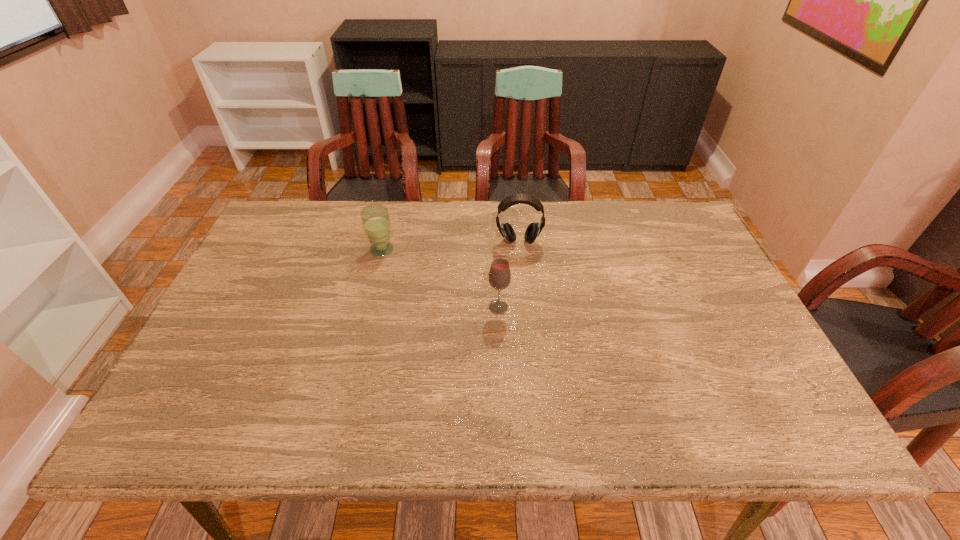
This screenshot has height=540, width=960. Identify the location of empty location between the leftmost object and the earphone. (450, 246).

Find the location of a particular element. The image size is (960, 540). unoccupied area between the leftmost object and the earphone is located at coordinates (450, 246).

In order to click on vacant space in between the left glass and the nearer glass in this screenshot , I will do `click(440, 279)`.

Locate an element on the screen. object that stands as the closest to the earphone is located at coordinates (499, 275).

Locate an element on the screen. This screenshot has height=540, width=960. the closest object to the earphone is located at coordinates (499, 275).

The height and width of the screenshot is (540, 960). I want to click on vacant space that satisfies the following two spatial constraints: 1. on the front side of the nearer glass; 2. on the left side of the left glass, so click(x=368, y=307).

The width and height of the screenshot is (960, 540). Identify the location of vacant space that satisfies the following two spatial constraints: 1. on the front side of the right glass; 2. on the left side of the farther glass. (368, 307).

The image size is (960, 540). Find the location of `free point that satisfies the following two spatial constraints: 1. on the front side of the nearer glass; 2. on the right side of the farther glass`. free point that satisfies the following two spatial constraints: 1. on the front side of the nearer glass; 2. on the right side of the farther glass is located at coordinates (368, 307).